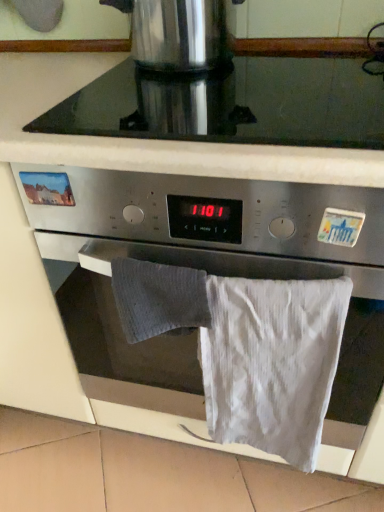
Question: Can you confirm if stainless steel coffee pot at upper center is positioned to the left of satin silver oven at center?

Choices:
 (A) no
 (B) yes

Answer: (B)

Question: Is stainless steel coffee pot at upper center looking in the opposite direction of satin silver oven at center?

Choices:
 (A) yes
 (B) no

Answer: (B)

Question: Is stainless steel coffee pot at upper center in front of satin silver oven at center?

Choices:
 (A) no
 (B) yes

Answer: (A)

Question: From a real-world perspective, is stainless steel coffee pot at upper center positioned over satin silver oven at center based on gravity?

Choices:
 (A) yes
 (B) no

Answer: (A)

Question: Considering the relative sizes of stainless steel coffee pot at upper center and satin silver oven at center in the image provided, is stainless steel coffee pot at upper center bigger than satin silver oven at center?

Choices:
 (A) yes
 (B) no

Answer: (B)

Question: Based on their sizes in the image, would you say white cotton bath towel at lower center is bigger or smaller than black glass at upper center?

Choices:
 (A) big
 (B) small

Answer: (B)

Question: Is point (238, 402) positioned closer to the camera than point (201, 105)?

Choices:
 (A) farther
 (B) closer

Answer: (A)

Question: From a real-world perspective, relative to black glass at upper center, is white cotton bath towel at lower center vertically above or below?

Choices:
 (A) above
 (B) below

Answer: (B)

Question: Considering the positions of white cotton bath towel at lower center and black glass at upper center in the image, is white cotton bath towel at lower center wider or thinner than black glass at upper center?

Choices:
 (A) thin
 (B) wide

Answer: (A)

Question: Considering their positions, is white cotton bath towel at lower center located in front of or behind satin silver oven at center?

Choices:
 (A) front
 (B) behind

Answer: (B)

Question: In the image, is white cotton bath towel at lower center on the left side or the right side of satin silver oven at center?

Choices:
 (A) left
 (B) right

Answer: (B)

Question: From the image's perspective, relative to satin silver oven at center, is white cotton bath towel at lower center above or below?

Choices:
 (A) below
 (B) above

Answer: (A)

Question: Considering the positions of white cotton bath towel at lower center and satin silver oven at center in the image, is white cotton bath towel at lower center taller or shorter than satin silver oven at center?

Choices:
 (A) tall
 (B) short

Answer: (B)

Question: Would you say stainless steel coffee pot at upper center is to the left or to the right of black glass at upper center in the picture?

Choices:
 (A) left
 (B) right

Answer: (A)

Question: From a real-world perspective, is stainless steel coffee pot at upper center above or below black glass at upper center?

Choices:
 (A) below
 (B) above

Answer: (B)